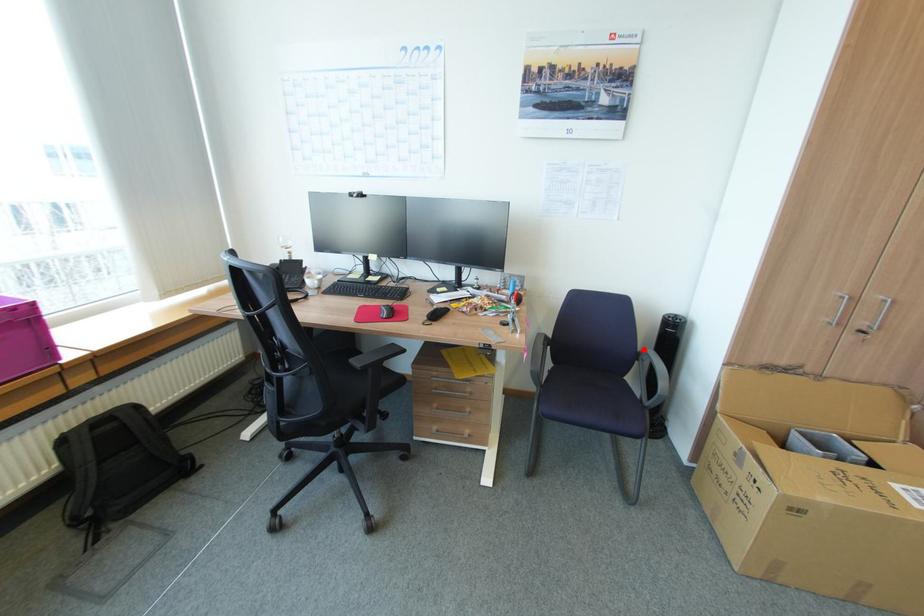
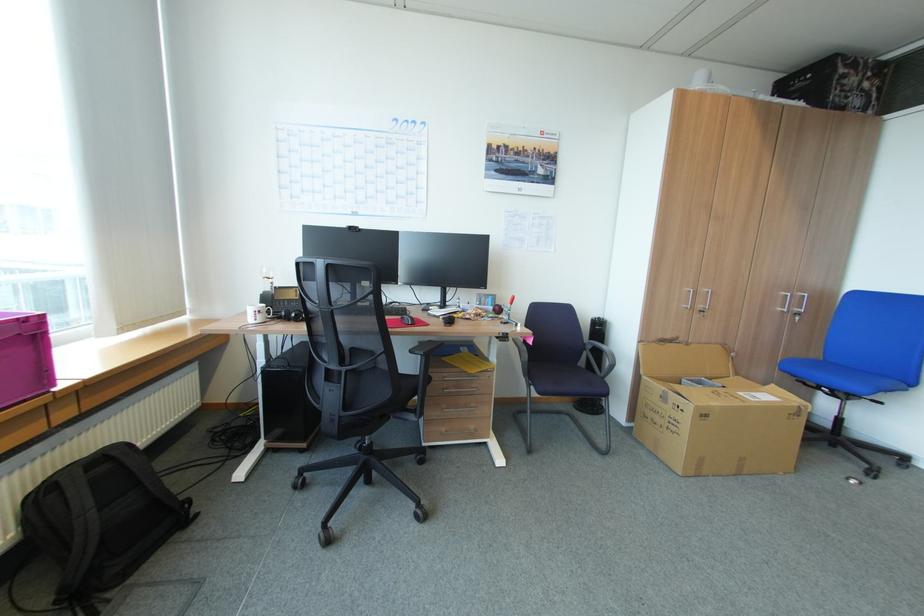
Question: I am providing you with two images of the same scene from different viewpoints. A red point is marked on the first image. Is the red point's position out of view in image 2?

Choices:
 (A) Yes
 (B) No

Answer: (B)